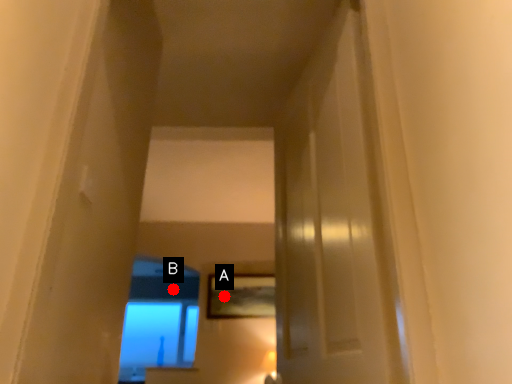
Question: Two points are circled on the image, labeled by A and B beside each circle. Which point is closer to the camera?

Choices:
 (A) A is closer
 (B) B is closer

Answer: (A)